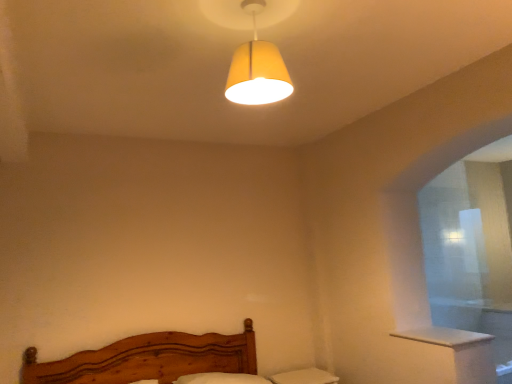
Locate an element on the screen. Image resolution: width=512 pixels, height=384 pixels. matte yellow fabric lampshade at upper center is located at coordinates (257, 65).

The width and height of the screenshot is (512, 384). What do you see at coordinates (257, 65) in the screenshot? I see `matte yellow fabric lampshade at upper center` at bounding box center [257, 65].

Measure the distance between point (460, 336) and camera.

Point (460, 336) and camera are 8.12 feet apart from each other.

This screenshot has width=512, height=384. What do you see at coordinates (442, 336) in the screenshot?
I see `white wood window sill at lower right` at bounding box center [442, 336].

Where is `white wood window sill at lower right`? This screenshot has width=512, height=384. white wood window sill at lower right is located at coordinates (442, 336).

What are the coordinates of `matte yellow fabric lampshade at upper center` in the screenshot? It's located at (257, 65).

Does matte yellow fabric lampshade at upper center appear on the right side of white wood window sill at lower right?

In fact, matte yellow fabric lampshade at upper center is to the left of white wood window sill at lower right.

Considering the relative positions of matte yellow fabric lampshade at upper center and white wood window sill at lower right in the image provided, is matte yellow fabric lampshade at upper center behind white wood window sill at lower right?

No, it is not.

Considering the positions of points (274, 19) and (410, 339), is point (274, 19) closer to camera compared to point (410, 339)?

Yes.

From the image's perspective, which one is positioned higher, matte yellow fabric lampshade at upper center or white wood window sill at lower right?

From the image's view, matte yellow fabric lampshade at upper center is above.

From a real-world perspective, is matte yellow fabric lampshade at upper center physically above white wood window sill at lower right?

Yes, from a real-world perspective, matte yellow fabric lampshade at upper center is on top of white wood window sill at lower right.

Looking at their sizes, would you say matte yellow fabric lampshade at upper center is wider or thinner than white wood window sill at lower right?

In the image, matte yellow fabric lampshade at upper center appears to be more narrow than white wood window sill at lower right.

Between matte yellow fabric lampshade at upper center and white wood window sill at lower right, which one has less height?

white wood window sill at lower right is shorter.

Considering the sizes of objects matte yellow fabric lampshade at upper center and white wood window sill at lower right in the image provided, who is bigger, matte yellow fabric lampshade at upper center or white wood window sill at lower right?

matte yellow fabric lampshade at upper center.

Would you say white wood window sill at lower right is part of matte yellow fabric lampshade at upper center's contents?

No, white wood window sill at lower right is not surrounded by matte yellow fabric lampshade at upper center.

Is matte yellow fabric lampshade at upper center next to white wood window sill at lower right and touching it?

They are not placed beside each other.

Does matte yellow fabric lampshade at upper center turn towards white wood window sill at lower right?

No.

What's the angular difference between matte yellow fabric lampshade at upper center and white wood window sill at lower right's facing directions?

90 degrees.

You are a GUI agent. You are given a task and a screenshot of the screen. Output one action in this format:
    pyautogui.click(x=<x>, y=<y>)
    Task: Click on the window sill that appears below the matte yellow fabric lampshade at upper center (from a real-world perspective)
    The height and width of the screenshot is (384, 512).
    Given the screenshot: What is the action you would take?
    (442, 336)

Is white wood window sill at lower right to the left or to the right of matte yellow fabric lampshade at upper center in the image?

From the image, it's evident that white wood window sill at lower right is to the right of matte yellow fabric lampshade at upper center.

Relative to matte yellow fabric lampshade at upper center, is white wood window sill at lower right in front or behind?

Clearly, white wood window sill at lower right is behind matte yellow fabric lampshade at upper center.

Does point (473, 340) come farther from viewer compared to point (230, 85)?

Yes, it is.

From the image's perspective, which object appears higher, white wood window sill at lower right or matte yellow fabric lampshade at upper center?

matte yellow fabric lampshade at upper center appears higher in the image.

From a real-world perspective, which object rests below the other?

From a 3D spatial view, white wood window sill at lower right is below.

Between white wood window sill at lower right and matte yellow fabric lampshade at upper center, which one has smaller width?

With smaller width is matte yellow fabric lampshade at upper center.

Does white wood window sill at lower right have a greater height compared to matte yellow fabric lampshade at upper center?

No, white wood window sill at lower right is not taller than matte yellow fabric lampshade at upper center.

Looking at the image, does white wood window sill at lower right seem bigger or smaller compared to matte yellow fabric lampshade at upper center?

In the image, white wood window sill at lower right appears to be smaller than matte yellow fabric lampshade at upper center.

Choose the correct answer: Is white wood window sill at lower right inside matte yellow fabric lampshade at upper center or outside it?

white wood window sill at lower right is spatially situated outside matte yellow fabric lampshade at upper center.

Is white wood window sill at lower right not close to matte yellow fabric lampshade at upper center?

Indeed, white wood window sill at lower right is not near matte yellow fabric lampshade at upper center.

Could you tell me if white wood window sill at lower right is facing matte yellow fabric lampshade at upper center?

No, white wood window sill at lower right is not aimed at matte yellow fabric lampshade at upper center.

Can you tell me how much white wood window sill at lower right and matte yellow fabric lampshade at upper center differ in facing direction?

The angle between the facing direction of white wood window sill at lower right and the facing direction of matte yellow fabric lampshade at upper center is 90 degrees.

This screenshot has width=512, height=384. In order to click on window sill located behind the matte yellow fabric lampshade at upper center in this screenshot , I will do `click(442, 336)`.

Locate an element on the screen. The width and height of the screenshot is (512, 384). lamp that is in front of the white wood window sill at lower right is located at coordinates pyautogui.click(x=257, y=65).

Locate an element on the screen. This screenshot has height=384, width=512. window sill below the matte yellow fabric lampshade at upper center (from the image's perspective) is located at coordinates (442, 336).